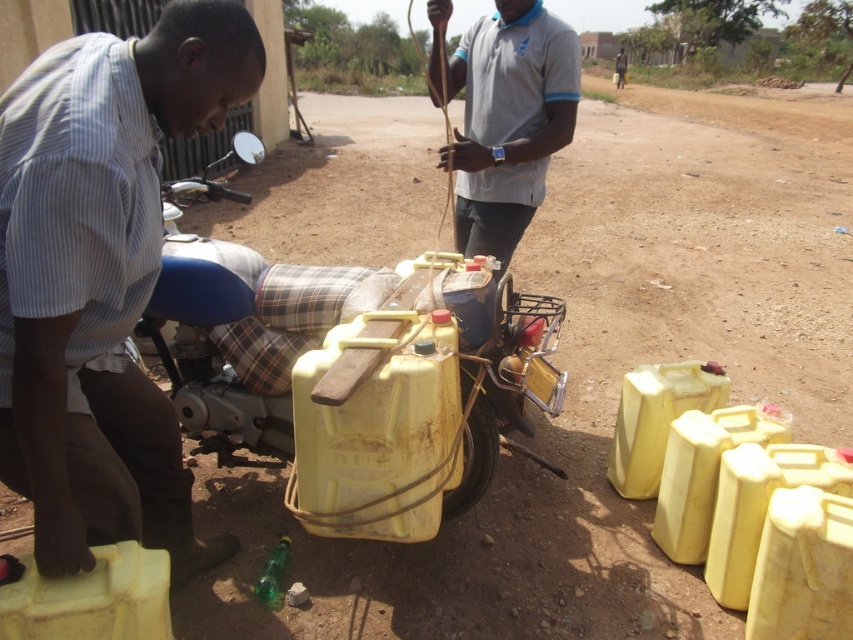
Does matte blue motorcycle at lower left appear on the right side of gray cotton shirt at upper center?

Incorrect, matte blue motorcycle at lower left is not on the right side of gray cotton shirt at upper center.

Can you confirm if matte blue motorcycle at lower left is wider than gray cotton shirt at upper center?

Yes, matte blue motorcycle at lower left is wider than gray cotton shirt at upper center.

Who is more distant from viewer, (9, 483) or (465, 204)?

The point (465, 204) is behind.

Where is `matte blue motorcycle at lower left`? The width and height of the screenshot is (853, 640). matte blue motorcycle at lower left is located at coordinates (102, 278).